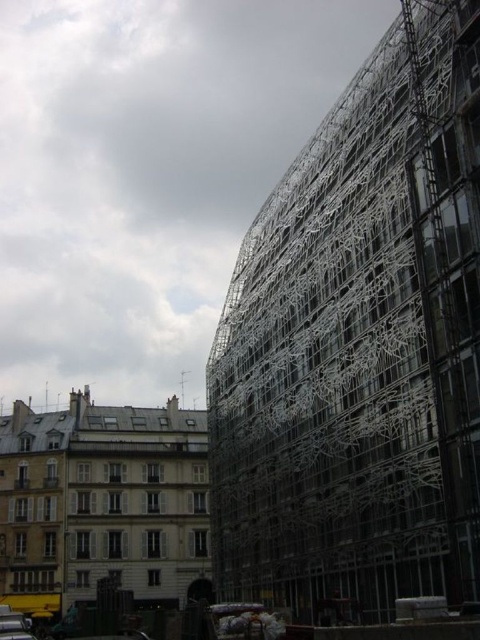
You are a construction worker standing at the base of the traditional European building on the left. You need to check the stability of the metallic scaffolding at right. Considering the distance between you and the scaffolding, can you safely walk to it without needing specialized equipment?

The metallic scaffolding at right is 45.26 meters away from the camera. Since you are at the base of the traditional European building on the left, the distance to the scaffolding is quite large. Walking that distance on the ground would be possible, but you might need to ensure there are clear pathways and no obstacles. However, specialized equipment like a ladder or harness might be necessary if you need to climb or work at height near the scaffolding.

You are driving a metallic silver car at lower left and want to park it in a spot near the buildings. Considering the position of the metallic scaffolding at right, which side of the car should you avoid to prevent collision with the scaffolding?

The metallic scaffolding at right is positioned on the right side of the metallic silver car at lower left, so you should avoid the right side of the car to prevent collision with the scaffolding.